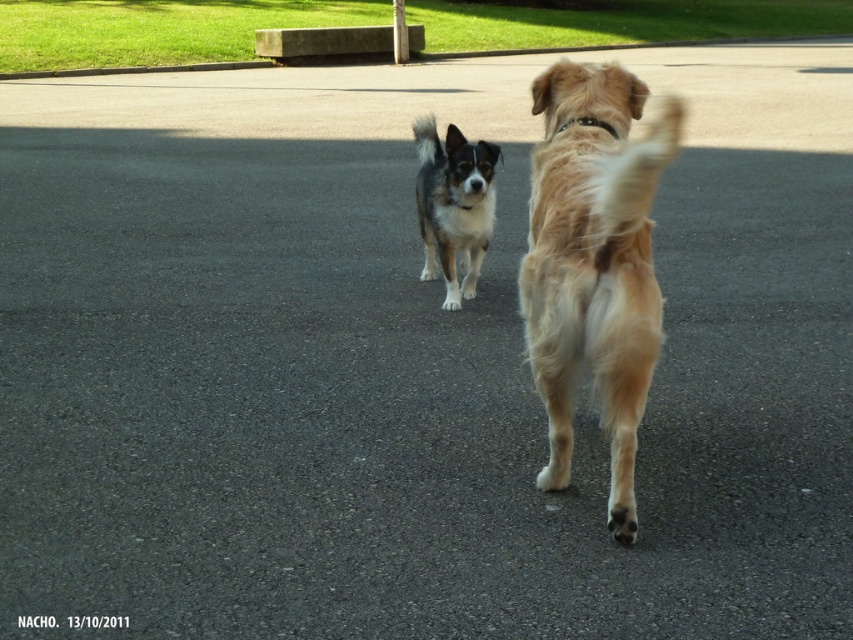
Question: Does golden fur dog at center have a smaller size compared to black and white fur at center?

Choices:
 (A) yes
 (B) no

Answer: (B)

Question: Which object appears farthest from the camera in this image?

Choices:
 (A) golden fur dog at center
 (B) black and white fur at center

Answer: (B)

Question: Is golden fur dog at center further to camera compared to black and white fur at center?

Choices:
 (A) yes
 (B) no

Answer: (B)

Question: Can you confirm if golden fur dog at center is thinner than black and white fur at center?

Choices:
 (A) no
 (B) yes

Answer: (A)